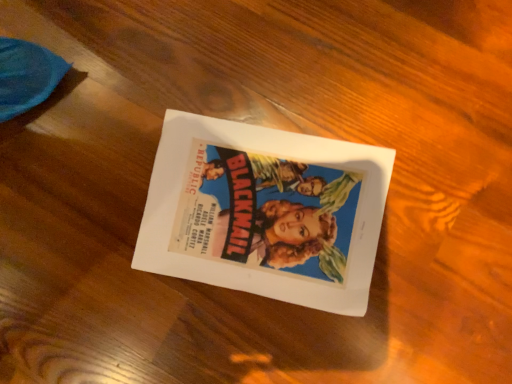
In order to face white paper at center, should I rotate leftwards or rightwards?

Turn right by 0.803 degrees to look at white paper at center.

What is the approximate width of white paper at center?

white paper at center is 8.90 inches wide.

Describe the element at coordinates (265, 212) in the screenshot. The image size is (512, 384). I see `white paper at center` at that location.

The width and height of the screenshot is (512, 384). In order to click on white paper at center in this screenshot , I will do [x=265, y=212].

Locate an element on the screen. The image size is (512, 384). white paper at center is located at coordinates (265, 212).